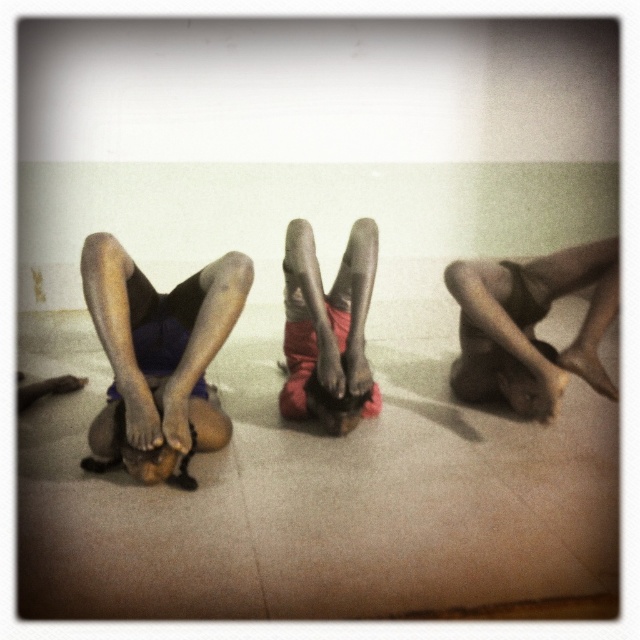
You are a photographer taking a photo of the dark skin legs at center and the smooth skin legs at center. Which pair of legs should you adjust to ensure they are aligned properly in the center of the frame?

The dark skin legs at center is to the left of smooth skin legs at center, so you should move the dark skin legs at center slightly to the right to align them properly in the center of the frame.

You are a photographer standing at the edge of the room where the headstand pose is taking place. You want to capture a closeup shot of the dark skin legs at center. Given that your camera has a minimum focusing distance of 2 meters, will you be able to take the photo without moving closer?

The dark skin legs at center are 2.08 meters away from the camera. Since the minimum focusing distance is 2 meters, the photographer can take the photo without moving closer because the distance is just beyond the required minimum.